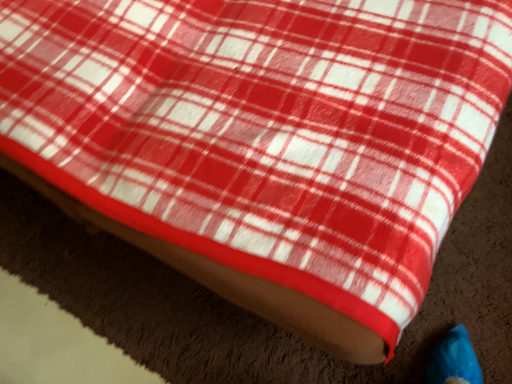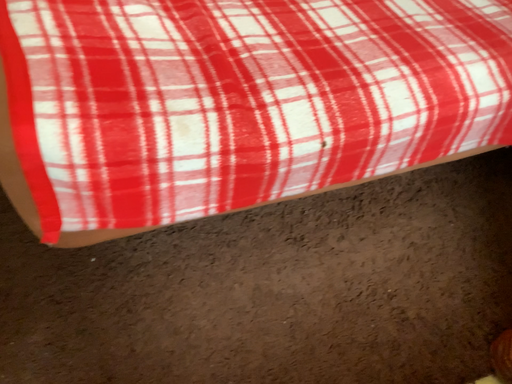
Question: Which way did the camera rotate in the video?

Choices:
 (A) rotated upward
 (B) rotated downward

Answer: (A)